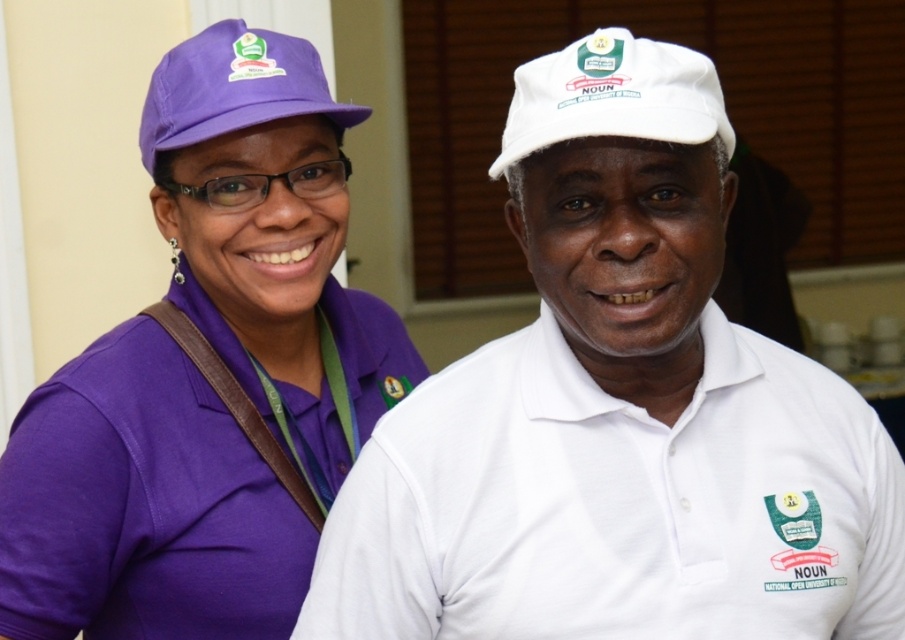
Consider the image. You are a photographer trying to capture a clear photo of both the white matte cap at upper center and the white matte baseball cap at upper center. Since they are positioned close to each other, will you be able to focus on both caps simultaneously without one being blurry?

The white matte cap at upper center is in front of the white matte baseball cap at upper center, so focusing on the front cap will leave the one behind slightly out of focus. To capture both clearly, adjust the camera focus to a point between them or use a smaller aperture for deeper depth of field.

You are a photographer trying to capture the white matte cap at upper center in the image. The camera you are using has a focus point at coordinate 0.6, 0.7. Will the cap be in focus?

The white matte cap at upper center is at point (618, 412), which is close to the focus point (633, 384). Therefore, the cap will likely be in focus.

Based on the photo, you are taking a photo of two people standing in a room with a window behind them. You notice two points in the image at coordinates point (593,116) and point (51,413). Which point is closer to the camera?

Point (593,116) is closer to the camera than point (51,413).